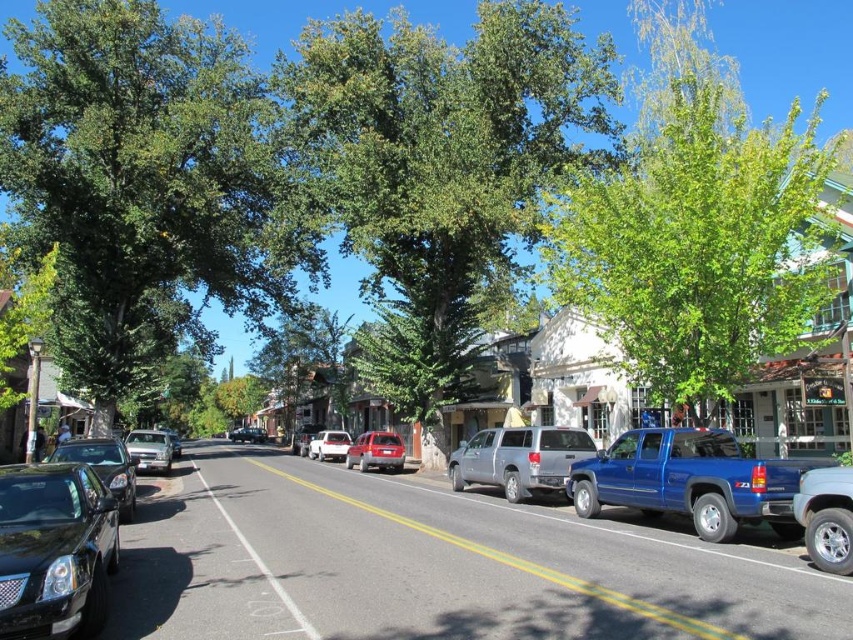
Question: Where is blue metallic pickup truck at right located in relation to satin silver sedan at center in the image?

Choices:
 (A) right
 (B) left

Answer: (A)

Question: Is blue metallic pickup truck at right below blue metallic truck at center?

Choices:
 (A) yes
 (B) no

Answer: (B)

Question: Is shiny black sedan at left below satin red suv at center?

Choices:
 (A) no
 (B) yes

Answer: (A)

Question: Which object is positioned farthest from the silver metallic sedan at left?

Choices:
 (A) green leafy tree at upper right
 (B) blue metallic truck at center
 (C) green leafy tree at center
 (D) shiny black sedan at left

Answer: (A)

Question: Which object appears farthest from the camera in this image?

Choices:
 (A) white matte car at center
 (B) blue metallic truck at center

Answer: (A)

Question: Which object appears farthest from the camera in this image?

Choices:
 (A) satin red suv at center
 (B) silver metallic suv at center
 (C) green leafy tree at upper right

Answer: (A)